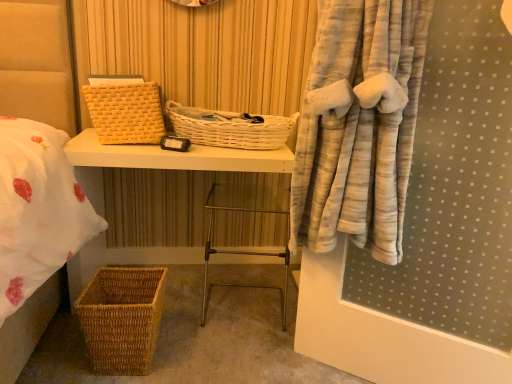
Locate an element on the screen. The height and width of the screenshot is (384, 512). free spot in front of woven wicker basket at lower left is located at coordinates (181, 349).